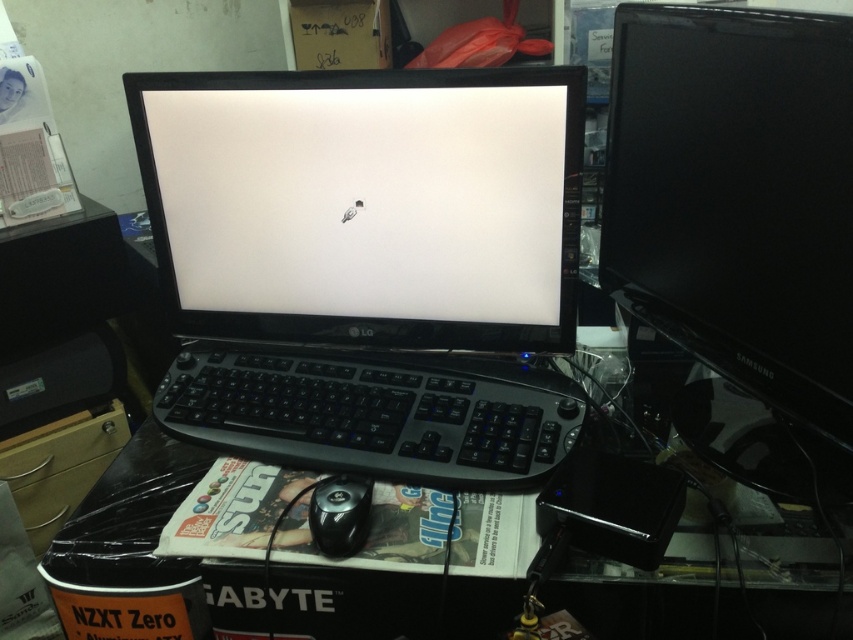
Question: Which of the following is the closest to the observer?

Choices:
 (A) black plastic monitor at center
 (B) black plastic keyboard at center

Answer: (B)

Question: Which of these objects is positioned closest to the black plastic mouse at center?

Choices:
 (A) black glossy monitor at right
 (B) black plastic monitor at center
 (C) black plastic keyboard at center
 (D) black plastic computer desk at center

Answer: (C)

Question: Is black glossy monitor at right to the right of black plastic keyboard at center from the viewer's perspective?

Choices:
 (A) yes
 (B) no

Answer: (A)

Question: Based on their relative distances, which object is farther from the black plastic computer desk at center?

Choices:
 (A) black plastic monitor at center
 (B) black glossy monitor at right
 (C) black plastic keyboard at center
 (D) black plastic mouse at center

Answer: (B)

Question: Can you confirm if black plastic monitor at center is positioned to the left of black plastic mouse at center?

Choices:
 (A) yes
 (B) no

Answer: (A)

Question: Observing the image, what is the correct spatial positioning of black glossy monitor at right in reference to black plastic computer desk at center?

Choices:
 (A) above
 (B) below

Answer: (A)